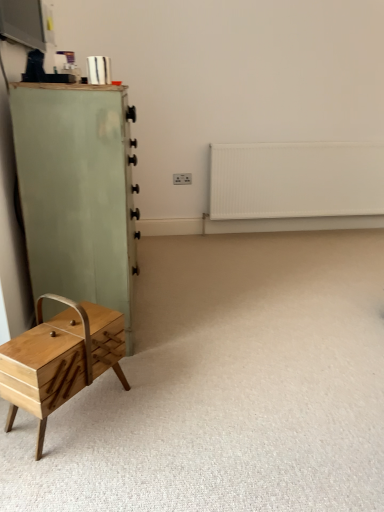
What do you see at coordinates (45, 365) in the screenshot? The image size is (384, 512). I see `natural wood drawer at lower left` at bounding box center [45, 365].

Measure the distance between natural wood drawer at lower left and camera.

The distance of natural wood drawer at lower left from camera is 4.29 feet.

What do you see at coordinates (227, 386) in the screenshot? The image size is (384, 512). I see `wooden sewing box at lower left` at bounding box center [227, 386].

I want to click on light green wood chest of drawers at left, so click(77, 191).

Measure the distance between light green wood chest of drawers at left and camera.

The depth of light green wood chest of drawers at left is 4.99 feet.

Find the location of a particular element. This screenshot has width=384, height=512. natural wood drawer at lower left is located at coordinates (45, 365).

Is white matte radiator at upper right turned away from natural wood drawer at lower left?

No, natural wood drawer at lower left is not at the back of white matte radiator at upper right.

Considering the relative positions of white matte radiator at upper right and natural wood drawer at lower left in the image provided, is white matte radiator at upper right to the left or to the right of natural wood drawer at lower left?

Based on their positions, white matte radiator at upper right is located to the right of natural wood drawer at lower left.

Is white matte radiator at upper right spatially inside natural wood drawer at lower left, or outside of it?

white matte radiator at upper right is not inside natural wood drawer at lower left, it's outside.

Does point (319, 210) come farther from viewer compared to point (49, 353)?

Yes, it is.

Which is farther from the camera, (148, 448) or (285, 186)?

Point (285, 186)

From a real-world perspective, which object stands above the other?

white matte radiator at upper right.

Is wooden sewing box at lower left positioned beyond the bounds of white matte radiator at upper right?

wooden sewing box at lower left lies outside white matte radiator at upper right's area.

Considering the positions of objects wooden sewing box at lower left and white matte radiator at upper right in the image provided, who is in front, wooden sewing box at lower left or white matte radiator at upper right?

wooden sewing box at lower left is more forward.

Is white matte radiator at upper right located outside wooden sewing box at lower left?

Yes, white matte radiator at upper right is not within wooden sewing box at lower left.

Is white matte radiator at upper right oriented towards wooden sewing box at lower left?

Yes, white matte radiator at upper right is oriented towards wooden sewing box at lower left.

Is white matte radiator at upper right bigger than wooden sewing box at lower left?

No.

How many degrees apart are the facing directions of white matte radiator at upper right and wooden sewing box at lower left?

89.5 degrees separate the facing orientations of white matte radiator at upper right and wooden sewing box at lower left.

Is natural wood drawer at lower left shorter than white matte radiator at upper right?

Indeed, natural wood drawer at lower left has a lesser height compared to white matte radiator at upper right.

Is natural wood drawer at lower left wider than white matte radiator at upper right?

Correct, the width of natural wood drawer at lower left exceeds that of white matte radiator at upper right.

Which is more to the right, natural wood drawer at lower left or white matte radiator at upper right?

white matte radiator at upper right is more to the right.

Considering the relative positions of natural wood drawer at lower left and white matte radiator at upper right in the image provided, is natural wood drawer at lower left in front of white matte radiator at upper right?

That is True.

Is natural wood drawer at lower left wider than wooden sewing box at lower left?

In fact, natural wood drawer at lower left might be narrower than wooden sewing box at lower left.

How many degrees apart are the facing directions of natural wood drawer at lower left and wooden sewing box at lower left?

The angle between the facing direction of natural wood drawer at lower left and the facing direction of wooden sewing box at lower left is 37.3 degrees.

Is natural wood drawer at lower left not near wooden sewing box at lower left?

They are positioned close to each other.

Considering the sizes of objects natural wood drawer at lower left and wooden sewing box at lower left in the image provided, who is taller, natural wood drawer at lower left or wooden sewing box at lower left?

natural wood drawer at lower left is taller.

Are light green wood chest of drawers at left and white matte radiator at upper right far apart?

light green wood chest of drawers at left is positioned a significant distance from white matte radiator at upper right.

Is light green wood chest of drawers at left not inside white matte radiator at upper right?

Yes, light green wood chest of drawers at left is outside of white matte radiator at upper right.

From a real-world perspective, is light green wood chest of drawers at left physically located above or below white matte radiator at upper right?

light green wood chest of drawers at left is above white matte radiator at upper right.

Could you tell me if light green wood chest of drawers at left is turned towards white matte radiator at upper right?

Yes, light green wood chest of drawers at left is aimed at white matte radiator at upper right.

Between wooden sewing box at lower left and light green wood chest of drawers at left, which one has less height?

Standing shorter between the two is wooden sewing box at lower left.

From a real-world perspective, is wooden sewing box at lower left positioned over light green wood chest of drawers at left based on gravity?

No, from a real-world perspective, wooden sewing box at lower left is not above light green wood chest of drawers at left.

Is point (119, 429) closer to viewer compared to point (126, 163)?

Yes, point (119, 429) is in front of point (126, 163).

Find the location of a particular element. This screenshot has width=384, height=512. radiator located on the right of natural wood drawer at lower left is located at coordinates (296, 181).

This screenshot has height=512, width=384. What are the coordinates of `plain to the left of white matte radiator at upper right` in the screenshot? It's located at (227, 386).

Which object lies further to the anchor point natural wood drawer at lower left, white matte radiator at upper right or wooden sewing box at lower left?

white matte radiator at upper right is further to natural wood drawer at lower left.

Which object lies further to the anchor point wooden sewing box at lower left, light green wood chest of drawers at left or natural wood drawer at lower left?

light green wood chest of drawers at left is positioned further to the anchor wooden sewing box at lower left.

Based on their spatial positions, is natural wood drawer at lower left or white matte radiator at upper right further from wooden sewing box at lower left?

white matte radiator at upper right lies further to wooden sewing box at lower left than the other object.

Based on their spatial positions, is light green wood chest of drawers at left or white matte radiator at upper right closer to wooden sewing box at lower left?

The object closer to wooden sewing box at lower left is light green wood chest of drawers at left.

Based on their spatial positions, is white matte radiator at upper right or natural wood drawer at lower left closer to wooden sewing box at lower left?

natural wood drawer at lower left is positioned closer to the anchor wooden sewing box at lower left.

From the image, which object appears to be nearer to white matte radiator at upper right, natural wood drawer at lower left or light green wood chest of drawers at left?

light green wood chest of drawers at left.

Consider the image. Based on their spatial positions, is white matte radiator at upper right or wooden sewing box at lower left closer to light green wood chest of drawers at left?

Based on the image, wooden sewing box at lower left appears to be nearer to light green wood chest of drawers at left.

Considering their positions, is wooden sewing box at lower left positioned closer to light green wood chest of drawers at left than white matte radiator at upper right?

The object closer to light green wood chest of drawers at left is wooden sewing box at lower left.

You are a GUI agent. You are given a task and a screenshot of the screen. Output one action in this format:
    pyautogui.click(x=<x>, y=<y>)
    Task: Click on the drawer located between light green wood chest of drawers at left and wooden sewing box at lower left in the left-right direction
    The width and height of the screenshot is (384, 512).
    Given the screenshot: What is the action you would take?
    pyautogui.click(x=45, y=365)

You are a GUI agent. You are given a task and a screenshot of the screen. Output one action in this format:
    pyautogui.click(x=<x>, y=<y>)
    Task: Click on the chest of drawers between natural wood drawer at lower left and white matte radiator at upper right from front to back
    This screenshot has width=384, height=512.
    Given the screenshot: What is the action you would take?
    pyautogui.click(x=77, y=191)

Identify the location of the chest of drawers positioned between wooden sewing box at lower left and white matte radiator at upper right from near to far. pyautogui.click(x=77, y=191).

At what (x,y) coordinates should I click in order to perform the action: click on drawer positioned between wooden sewing box at lower left and white matte radiator at upper right from near to far. Please return your answer as a coordinate pair (x, y). The width and height of the screenshot is (384, 512). Looking at the image, I should click on (45, 365).